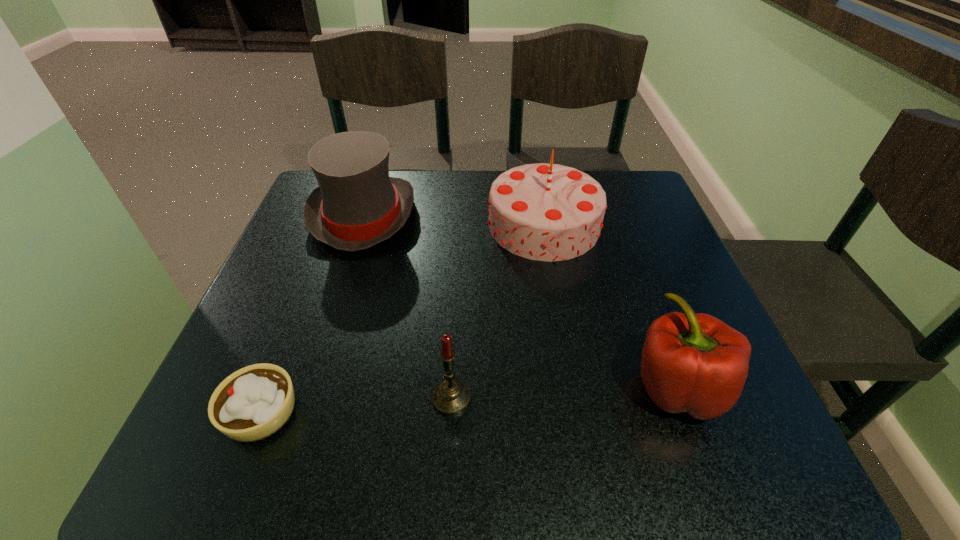
Locate an element on the screen. This screenshot has height=540, width=960. vacant region that satisfies the following two spatial constraints: 1. on the back side of the third object from right to left; 2. on the left side of the whipped cream is located at coordinates (267, 398).